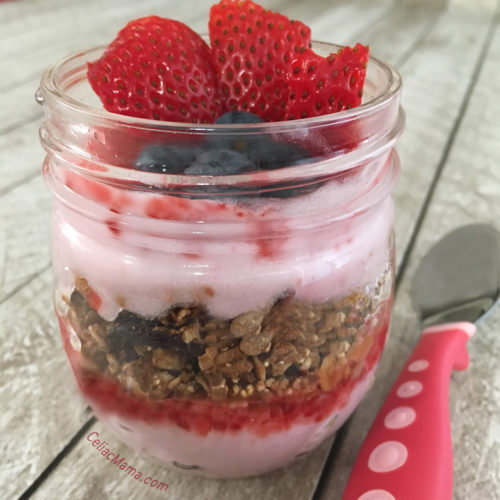
Identify the location of table. Image resolution: width=500 pixels, height=500 pixels. (439, 123).